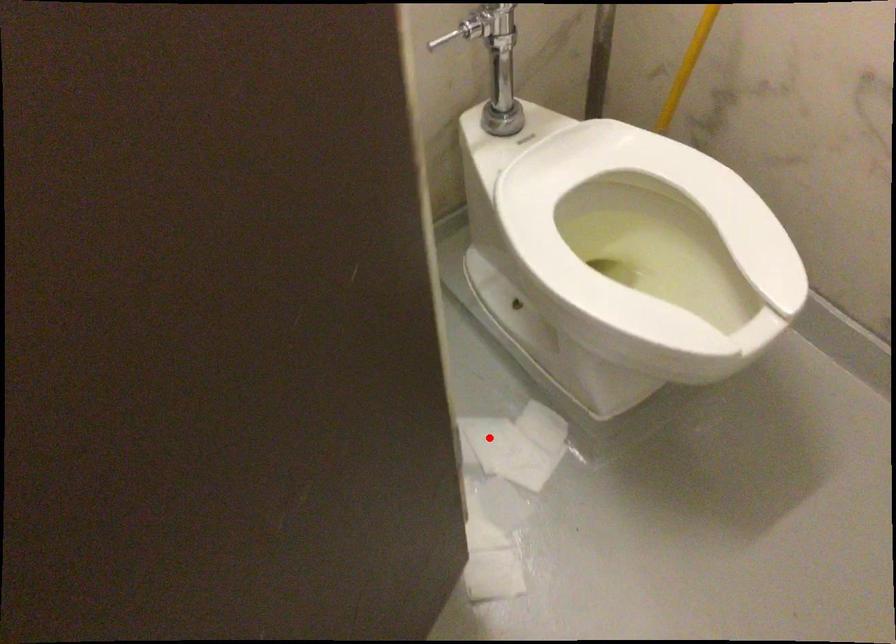
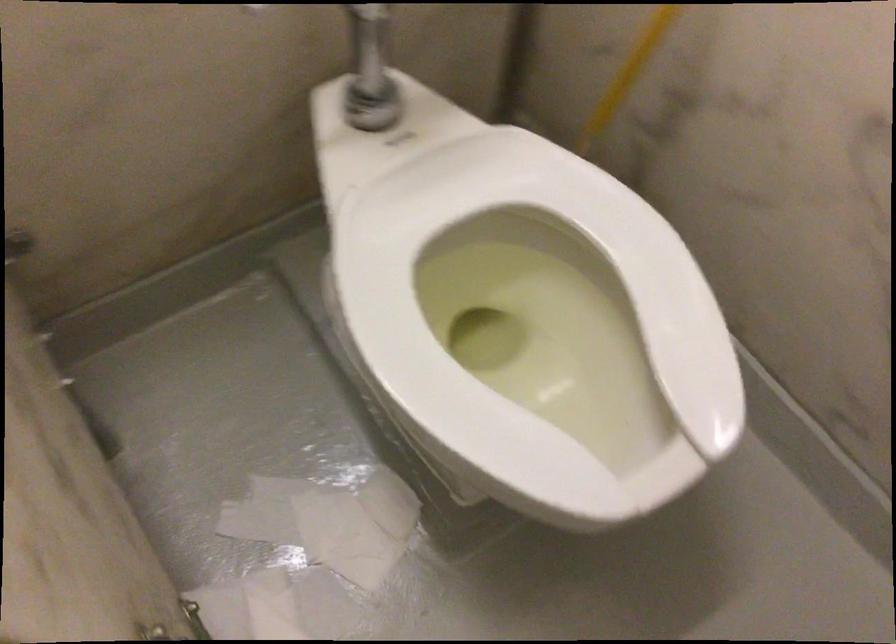
Find the pixel in the second image that matches the highlighted location in the first image.

(320, 529)